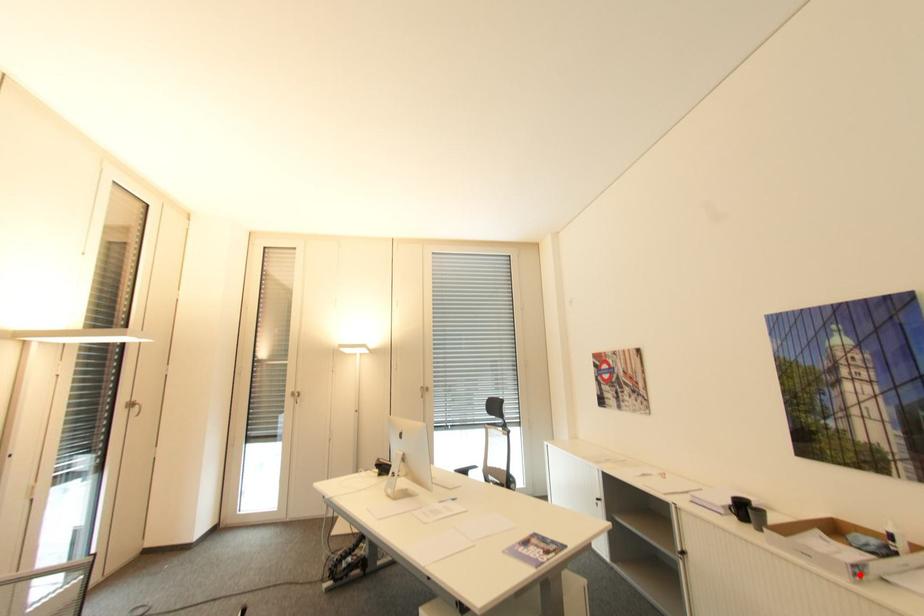
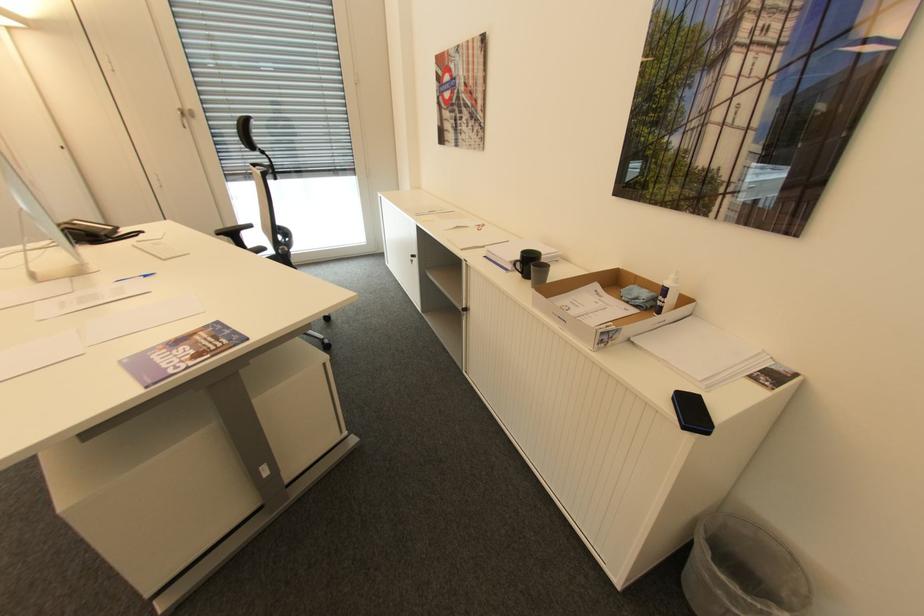
Locate, in the second image, the point that corresponds to the highlighted location in the first image.

(606, 342)